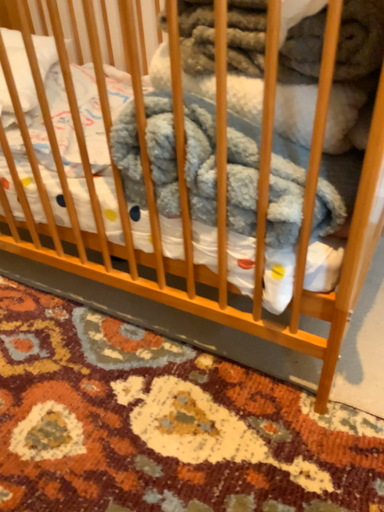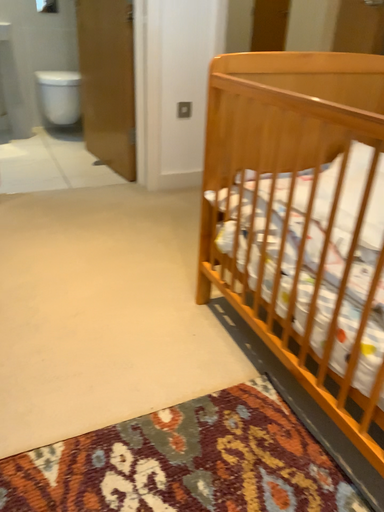
Question: Which way did the camera rotate in the video?

Choices:
 (A) rotated left
 (B) rotated right

Answer: (A)